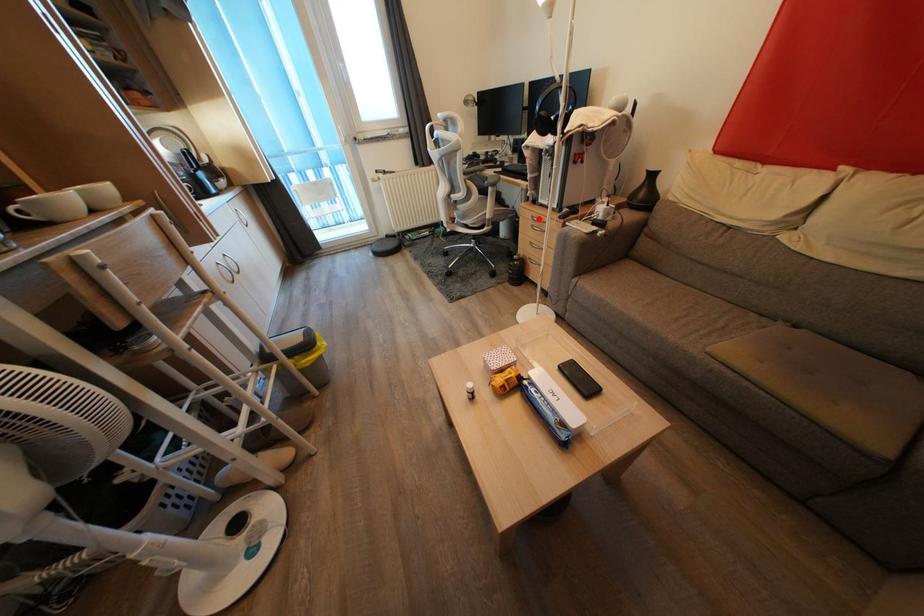
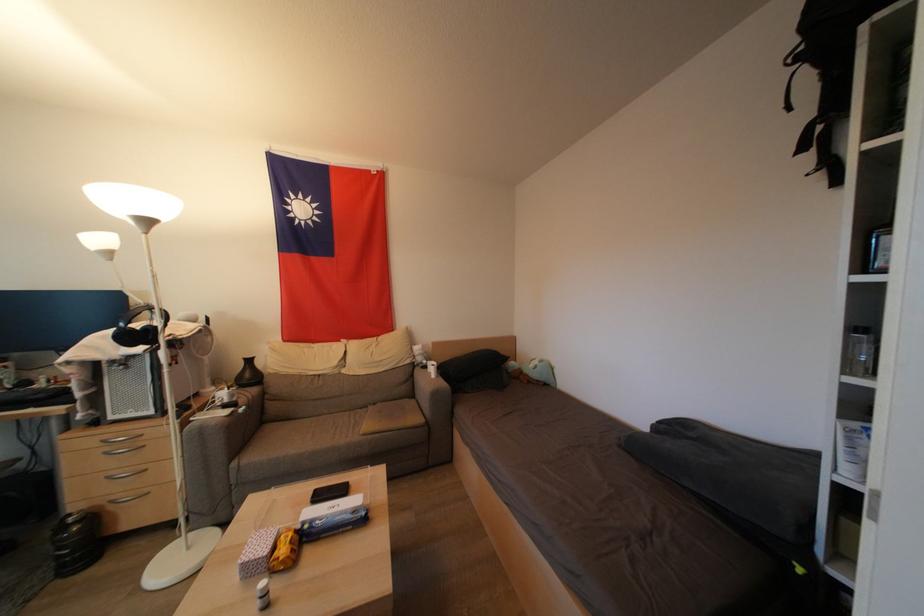
In the second image, find the point that corresponds to the highlighted location in the first image.

(112, 440)